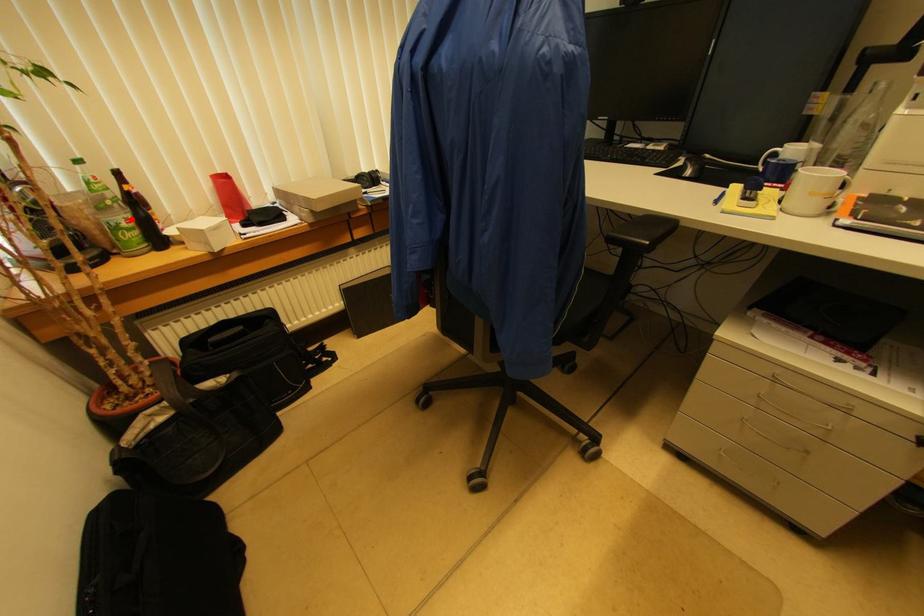
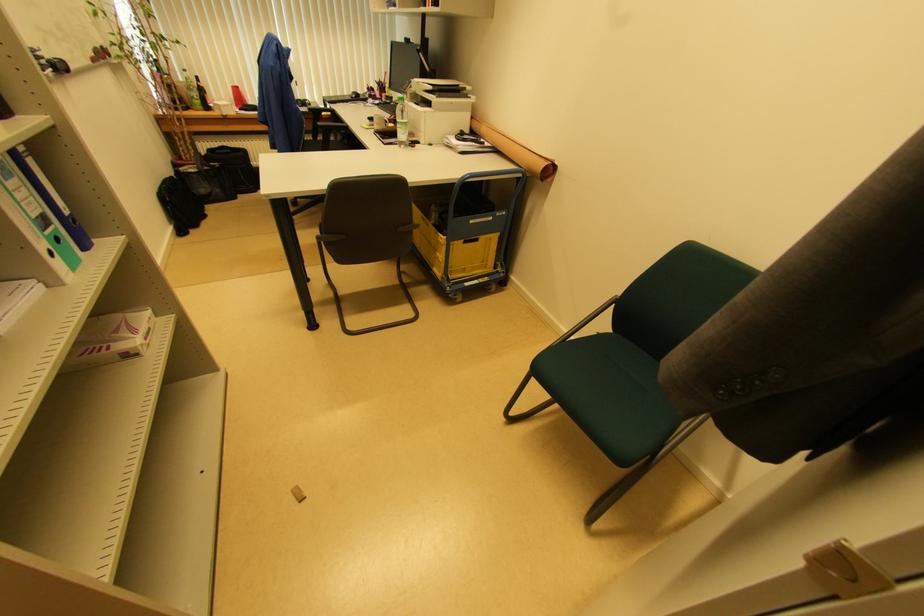
The point at the highlighted location is marked in the first image. Where is the corresponding point in the second image?

(200, 98)